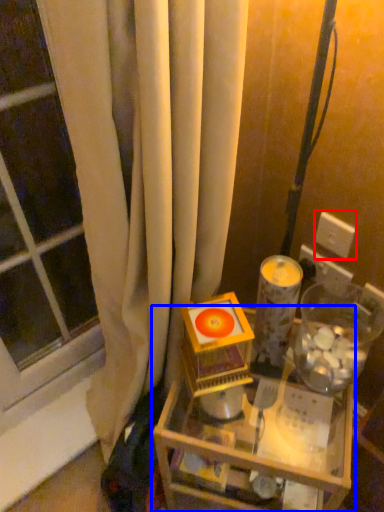
Question: Which object appears closest to the camera in this image, electric outlet (highlighted by a red box) or table (highlighted by a blue box)?

Choices:
 (A) electric outlet
 (B) table

Answer: (B)